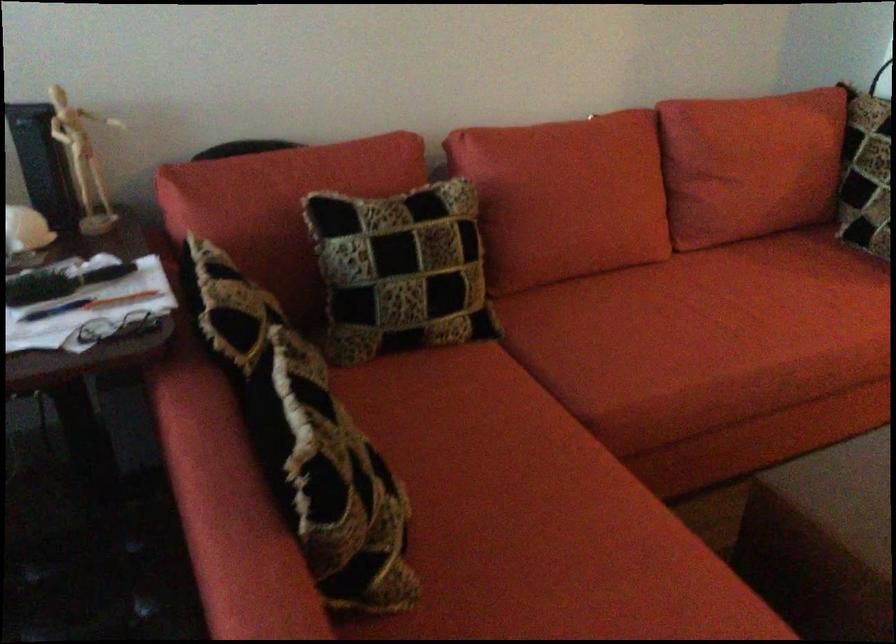
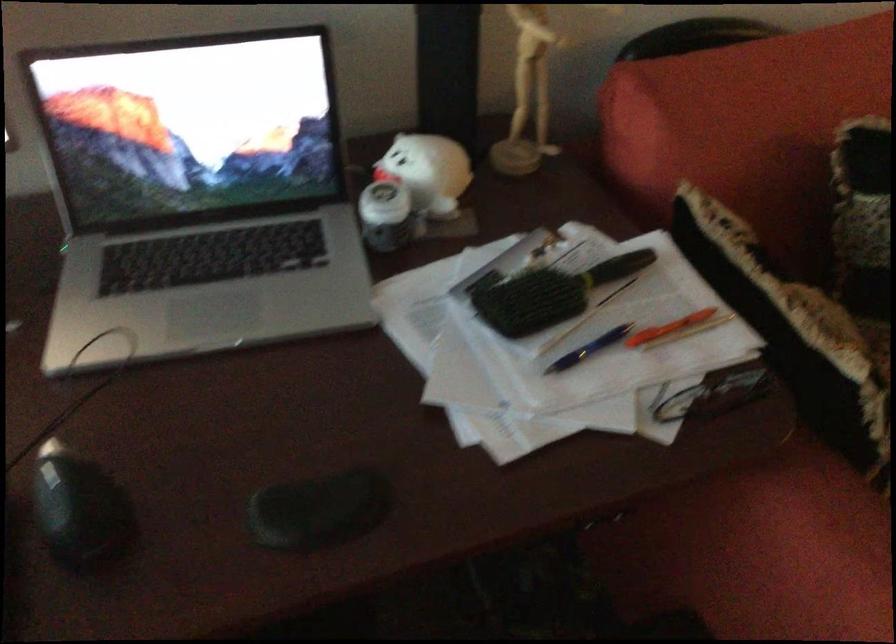
In the second image, find the point that corresponds to (x=119, y=308) in the first image.

(668, 328)